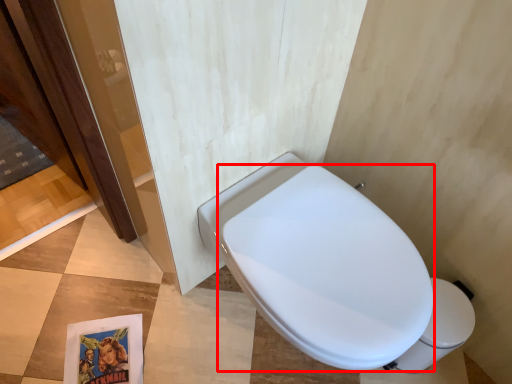
Question: From the image's perspective, where is bidet (annotated by the red box) located relative to toilet bowl?

Choices:
 (A) above
 (B) below

Answer: (A)